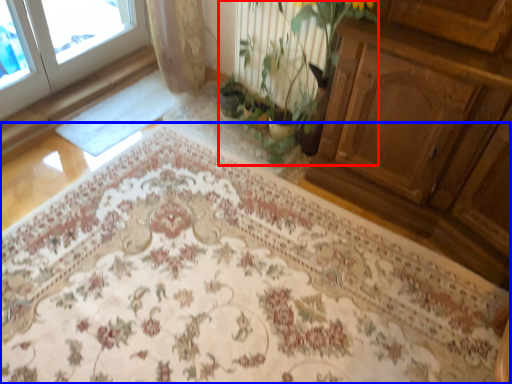
Question: Which object appears farthest to the camera in this image, floral arrangement (highlighted by a red box) or mat (highlighted by a blue box)?

Choices:
 (A) floral arrangement
 (B) mat

Answer: (A)